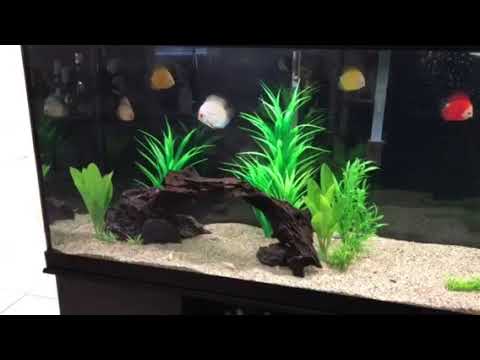
I want to click on aquarium, so click(285, 22).